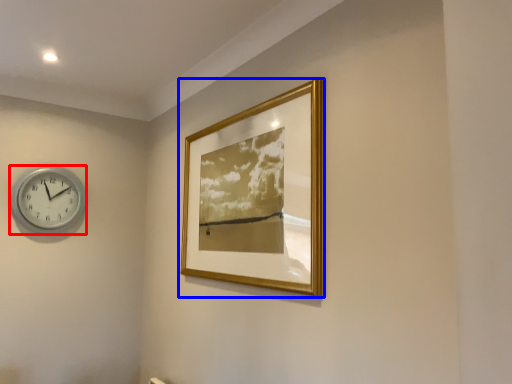
Question: Which object appears farthest to the camera in this image, wall clock (highlighted by a red box) or picture frame (highlighted by a blue box)?

Choices:
 (A) wall clock
 (B) picture frame

Answer: (A)